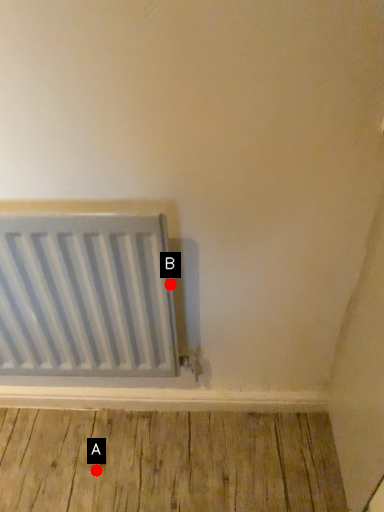
Question: Two points are circled on the image, labeled by A and B beside each circle. Which point is closer to the camera?

Choices:
 (A) A is closer
 (B) B is closer

Answer: (B)